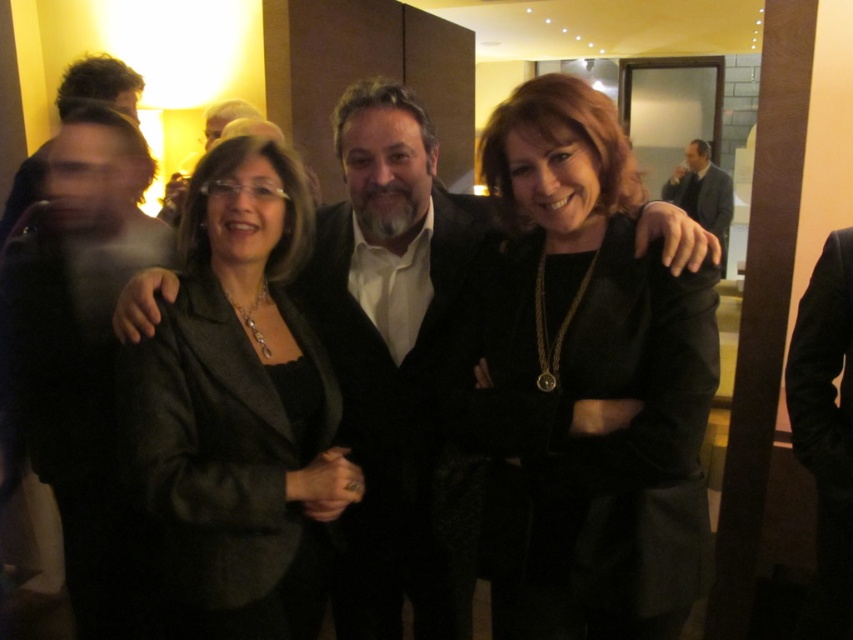
Question: Which object is farther from the camera taking this photo?

Choices:
 (A) matte black suit at center
 (B) black wool suit at center

Answer: (A)

Question: Which point appears farthest from the camera in this image?

Choices:
 (A) (352, 83)
 (B) (337, 596)
 (C) (178, 445)
 (D) (844, 449)

Answer: (A)

Question: Can you confirm if black matte blazer at center is positioned to the left of black wool suit at center?

Choices:
 (A) no
 (B) yes

Answer: (A)

Question: In this image, where is black matte blazer at center located relative to dark suit at upper right?

Choices:
 (A) below
 (B) above

Answer: (A)

Question: Does black matte blazer at center have a greater width compared to black wool suit at center?

Choices:
 (A) no
 (B) yes

Answer: (B)

Question: Which object is farther from the camera taking this photo?

Choices:
 (A) black wool suit at right
 (B) matte black blazer at center
 (C) black matte blazer at center
 (D) black wool suit at center

Answer: (A)